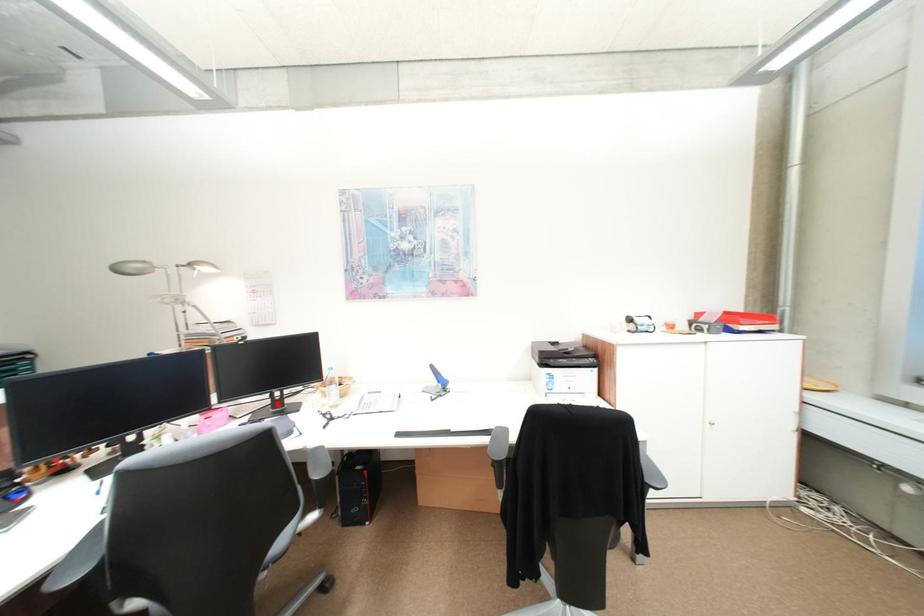
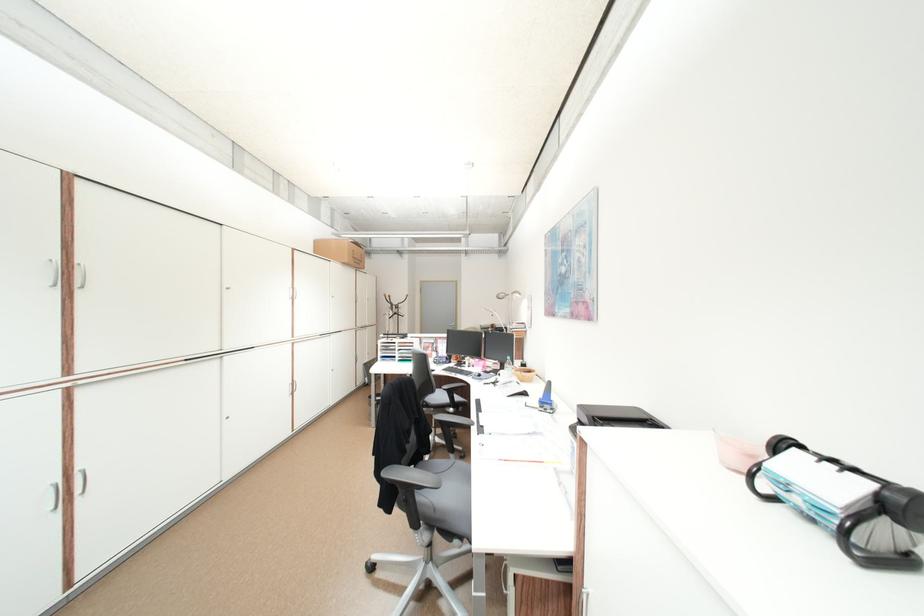
In the second image, find the point that corresponds to the highlighted location in the first image.

(507, 368)